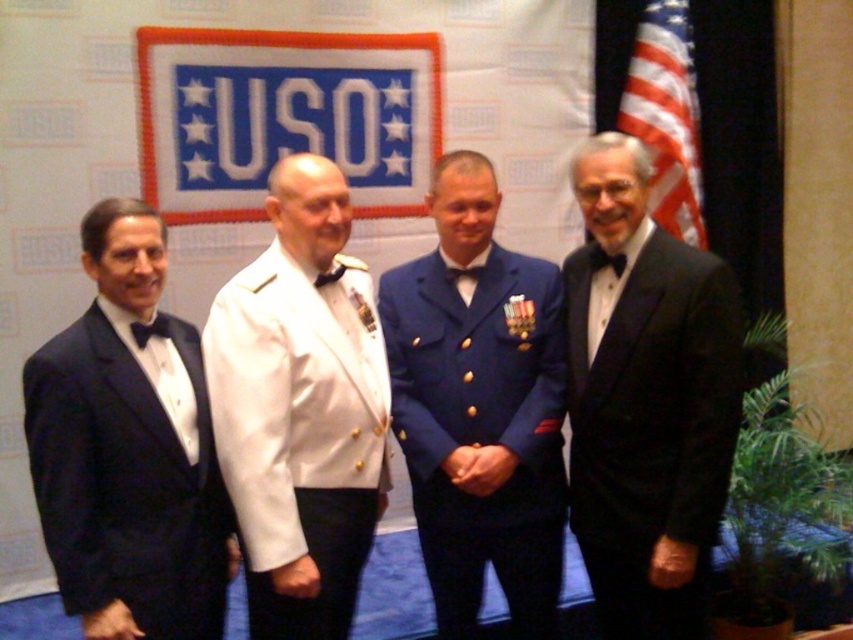
Question: In this image, where is black satin tuxedo at right located relative to white glossy uniform at center?

Choices:
 (A) left
 (B) right

Answer: (B)

Question: Which is nearer to the blue fabric uniform at center?

Choices:
 (A) white glossy uniform at center
 (B) black satin tuxedo at right

Answer: (B)

Question: Is blue fabric uniform at center smaller than matte black tuxedo at left?

Choices:
 (A) yes
 (B) no

Answer: (B)

Question: Which object is closer to the camera taking this photo?

Choices:
 (A) white glossy uniform at center
 (B) blue fabric uniform at center

Answer: (A)

Question: Which object is the closest to the matte black tuxedo at left?

Choices:
 (A) american flag at right
 (B) blue fabric uniform at center
 (C) white glossy uniform at center
 (D) black satin tuxedo at right

Answer: (C)

Question: Can you confirm if black satin tuxedo at right is positioned below american flag at right?

Choices:
 (A) no
 (B) yes

Answer: (B)